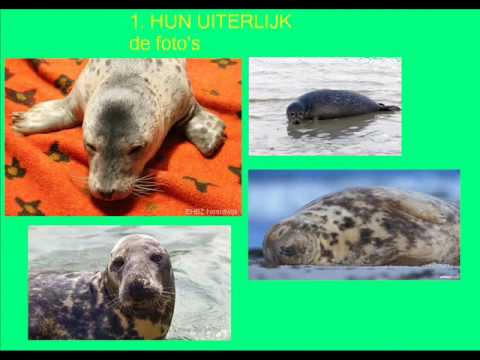
You are a GUI agent. You are given a task and a screenshot of the screen. Output one action in this format:
    pyautogui.click(x=<x>, y=<y>)
    Task: Click on the box
    This screenshot has width=480, height=360.
    Given the screenshot: What is the action you would take?
    pyautogui.click(x=221, y=72), pyautogui.click(x=270, y=144), pyautogui.click(x=266, y=211), pyautogui.click(x=205, y=256)